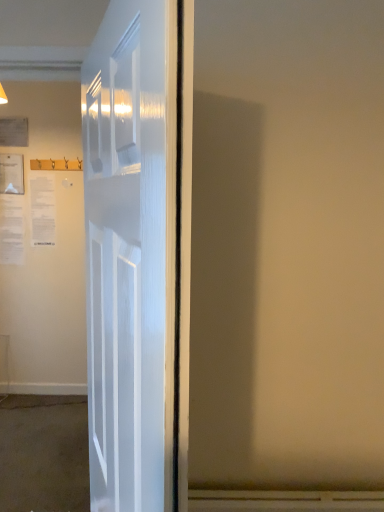
You are a GUI agent. You are given a task and a screenshot of the screen. Output one action in this format:
    pyautogui.click(x=<x>, y=<y>)
    Task: Click on the white glossy door at center
    This screenshot has height=512, width=384.
    Given the screenshot: What is the action you would take?
    pyautogui.click(x=132, y=252)

This screenshot has width=384, height=512. What do you see at coordinates (132, 252) in the screenshot?
I see `white glossy door at center` at bounding box center [132, 252].

At what (x,y) coordinates should I click in order to perform the action: click on white glossy door at center. Please return your answer as a coordinate pair (x, y). Looking at the image, I should click on (132, 252).